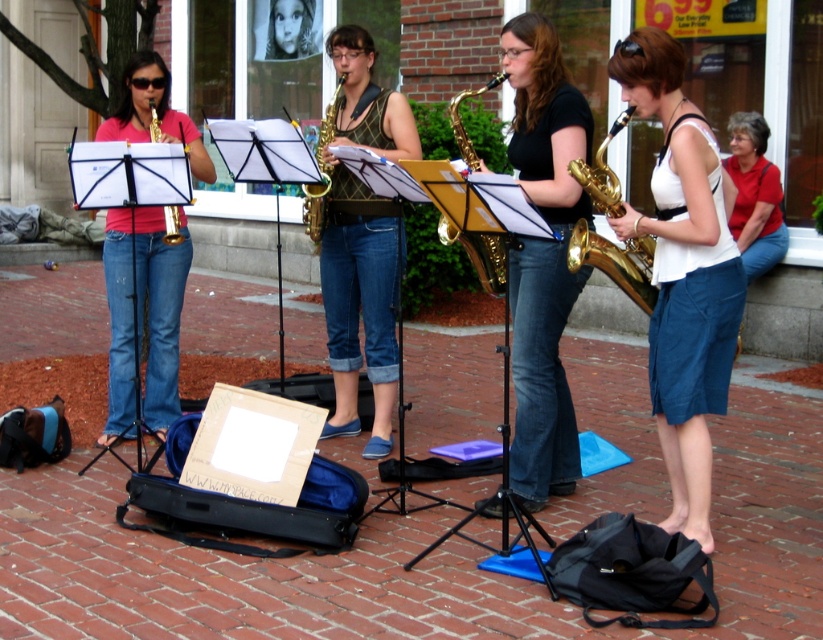
Is matte white tank top at center positioned behind gold shiny saxophone at right?

That is False.

Which is in front, point (672, 448) or point (575, 259)?

Point (575, 259) is in front.

This screenshot has height=640, width=823. What do you see at coordinates (682, 273) in the screenshot?
I see `matte white tank top at center` at bounding box center [682, 273].

I want to click on matte white tank top at center, so click(682, 273).

Which of these two, white cotton shirt at upper right or gold brass trumpet at left, stands shorter?

With less height is gold brass trumpet at left.

Is the position of white cotton shirt at upper right more distant than that of gold brass trumpet at left?

Yes, it is.

Where is `white cotton shirt at upper right`? Image resolution: width=823 pixels, height=640 pixels. white cotton shirt at upper right is located at coordinates (754, 195).

You are a GUI agent. You are given a task and a screenshot of the screen. Output one action in this format:
    pyautogui.click(x=<x>, y=<y>)
    Task: Click on the white cotton shirt at upper right
    
    Given the screenshot: What is the action you would take?
    pyautogui.click(x=754, y=195)

Does white cotton shirt at upper right appear over gold shiny saxophone at right?

Yes.

Can you confirm if white cotton shirt at upper right is taller than gold shiny saxophone at right?

Yes, white cotton shirt at upper right is taller than gold shiny saxophone at right.

I want to click on white cotton shirt at upper right, so click(x=754, y=195).

I want to click on white cotton shirt at upper right, so click(754, 195).